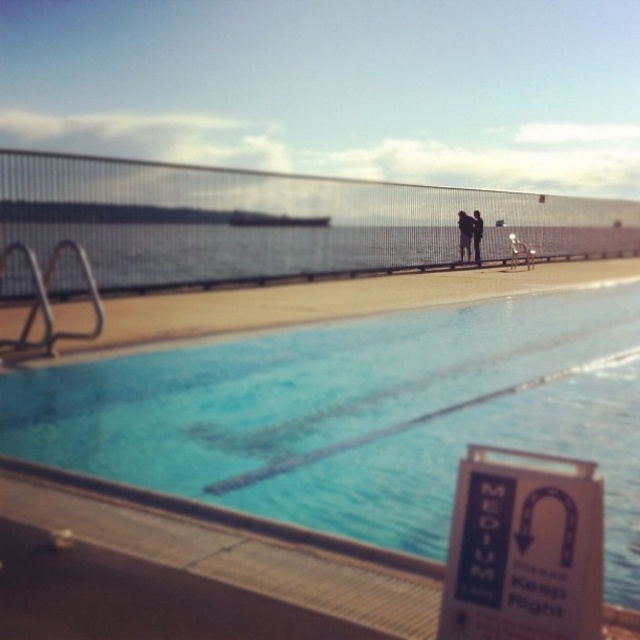
Can you confirm if blue smooth water at center is positioned to the right of white plastic sign at lower right?

No, blue smooth water at center is not to the right of white plastic sign at lower right.

Is blue smooth water at center below white plastic sign at lower right?

Actually, blue smooth water at center is above white plastic sign at lower right.

Which is in front, point (522, 413) or point (541, 540)?

Positioned in front is point (541, 540).

Image resolution: width=640 pixels, height=640 pixels. I want to click on blue smooth water at center, so click(x=355, y=416).

Who is lower down, blue smooth water at center or smooth skin swimmer at center?

blue smooth water at center is lower down.

Does blue smooth water at center appear on the left side of smooth skin swimmer at center?

Yes, blue smooth water at center is to the left of smooth skin swimmer at center.

Describe the element at coordinates (355, 416) in the screenshot. I see `blue smooth water at center` at that location.

This screenshot has width=640, height=640. Identify the location of blue smooth water at center. (355, 416).

Who is shorter, blue smooth water at center or black fabric person at center?

blue smooth water at center is shorter.

Which is behind, point (177, 387) or point (480, 250)?

The point (480, 250) is more distant.

Find the location of a particular element. blue smooth water at center is located at coordinates (355, 416).

Locate an element on the screen. blue smooth water at center is located at coordinates (355, 416).